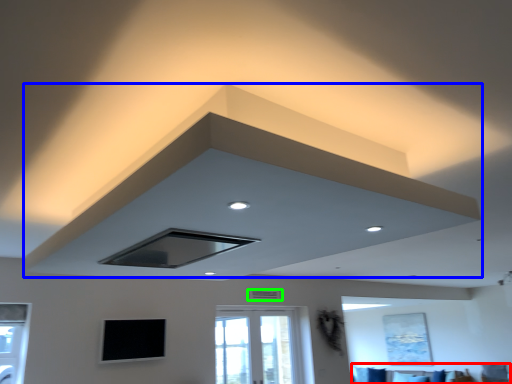
Question: Which object is the farthest from furniture (highlighted by a red box)? Choose among these: exhaust hood (highlighted by a blue box) or air conditioning (highlighted by a green box).

Choices:
 (A) exhaust hood
 (B) air conditioning

Answer: (A)